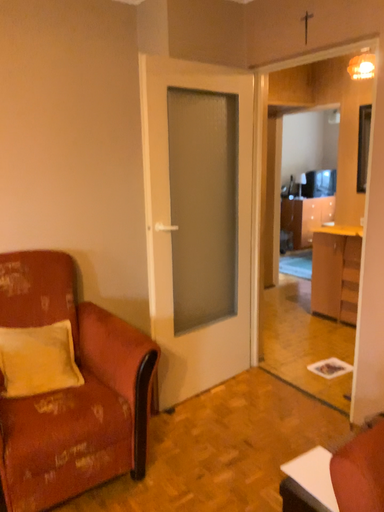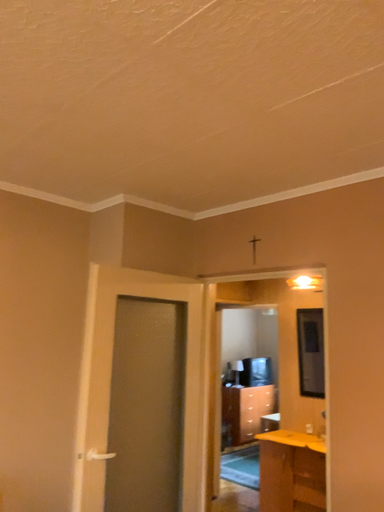
Question: Which way did the camera rotate in the video?

Choices:
 (A) rotated right
 (B) rotated left

Answer: (A)